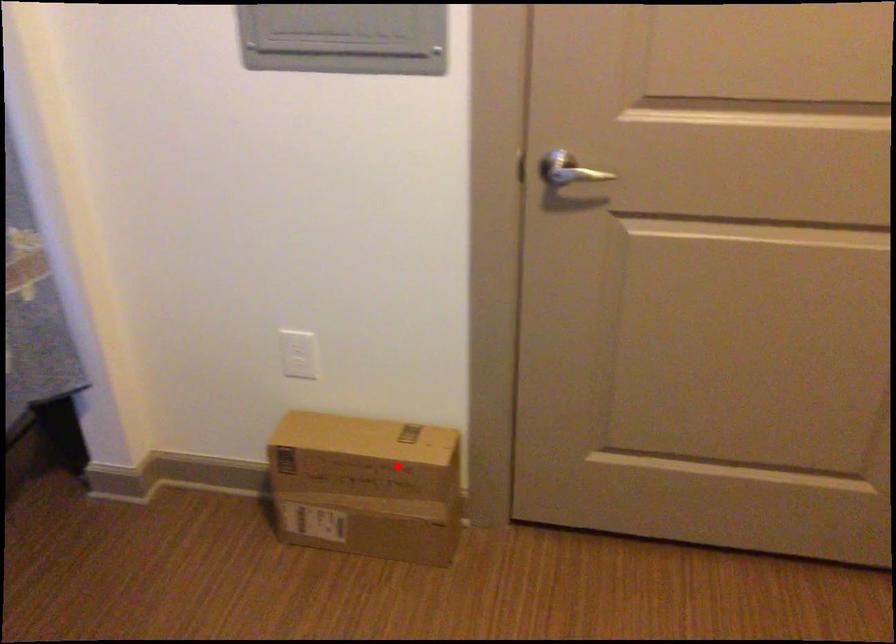
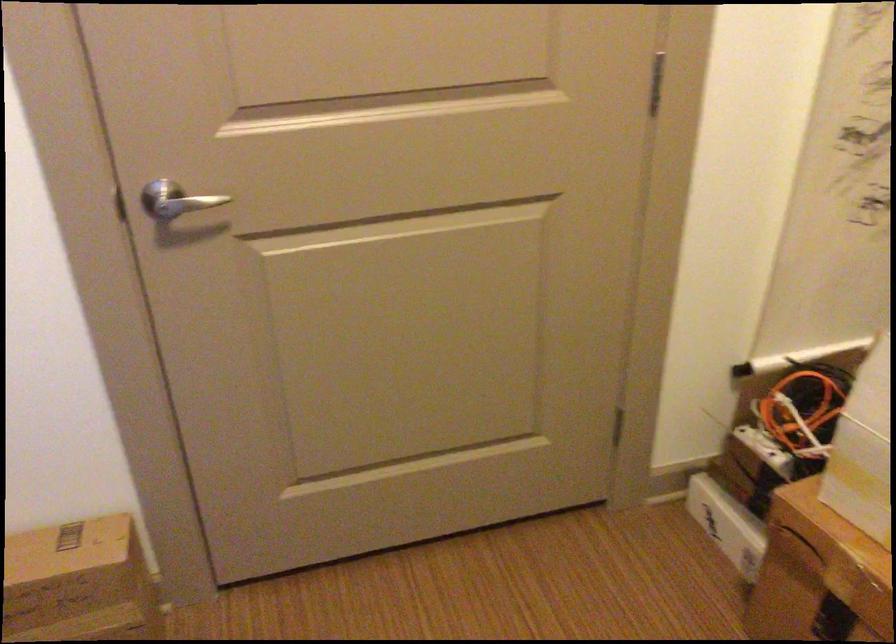
Find the pixel in the second image that matches the highlighted location in the first image.

(79, 583)